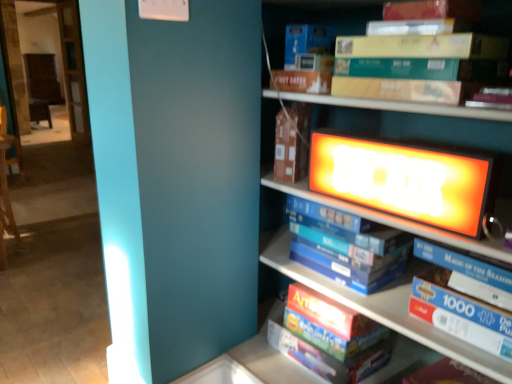
Question: Is white glossy puzzle box at center, the third book positioned from the top, directly adjacent to brown cardboard book at center?

Choices:
 (A) yes
 (B) no

Answer: (B)

Question: From the image's perspective, is white glossy puzzle box at center, which is counted as the second book, starting from the bottom, on top of brown cardboard book at center?

Choices:
 (A) no
 (B) yes

Answer: (A)

Question: Is white glossy puzzle box at center, the third book positioned from the top, positioned with its back to brown cardboard book at center?

Choices:
 (A) no
 (B) yes

Answer: (A)

Question: From the image's perspective, is white glossy puzzle box at center, the third book positioned from the top, below brown cardboard book at center?

Choices:
 (A) no
 (B) yes

Answer: (B)

Question: Is white glossy puzzle box at center, the third book positioned from the top, bigger than brown cardboard book at center?

Choices:
 (A) yes
 (B) no

Answer: (A)

Question: Considering the positions of point (340, 281) and point (356, 350), is point (340, 281) closer or farther from the camera than point (356, 350)?

Choices:
 (A) closer
 (B) farther

Answer: (B)

Question: Is blue cardboard puzzle at center, the third book positioned from the bottom, spatially inside red matte puzzle box at lower center, arranged as the 1th book when ordered from the bottom, or outside of it?

Choices:
 (A) inside
 (B) outside

Answer: (B)

Question: From the image's perspective, is blue cardboard puzzle at center, placed as the 2th book when sorted from top to bottom, located above or below red matte puzzle box at lower center, arranged as the 1th book when ordered from the bottom?

Choices:
 (A) below
 (B) above

Answer: (B)

Question: Considering the relative positions of blue cardboard puzzle at center, the third book positioned from the bottom, and red matte puzzle box at lower center, arranged as the 1th book when ordered from the bottom, in the image provided, is blue cardboard puzzle at center, the third book positioned from the bottom, to the left or to the right of red matte puzzle box at lower center, arranged as the 1th book when ordered from the bottom,?

Choices:
 (A) right
 (B) left

Answer: (B)

Question: Is matte wooden bookcase at upper right spatially inside red matte puzzle box at lower center, arranged as the 1th book when ordered from the bottom, or outside of it?

Choices:
 (A) inside
 (B) outside

Answer: (B)

Question: Does point (315, 14) appear closer or farther from the camera than point (377, 360)?

Choices:
 (A) closer
 (B) farther

Answer: (B)

Question: In terms of height, does matte wooden bookcase at upper right look taller or shorter compared to red matte puzzle box at lower center, which is counted as the fourth book, starting from the top?

Choices:
 (A) tall
 (B) short

Answer: (A)

Question: From a real-world perspective, relative to red matte puzzle box at lower center, which is counted as the fourth book, starting from the top, is matte wooden bookcase at upper right vertically above or below?

Choices:
 (A) below
 (B) above

Answer: (B)

Question: Does point pyautogui.click(x=386, y=243) appear closer or farther from the camera than point pyautogui.click(x=502, y=3)?

Choices:
 (A) closer
 (B) farther

Answer: (B)

Question: Visually, is blue cardboard puzzle at center, the third book positioned from the bottom, positioned to the left or to the right of yellow cardboard book at upper right, which is counted as the 4th book, starting from the bottom?

Choices:
 (A) left
 (B) right

Answer: (A)